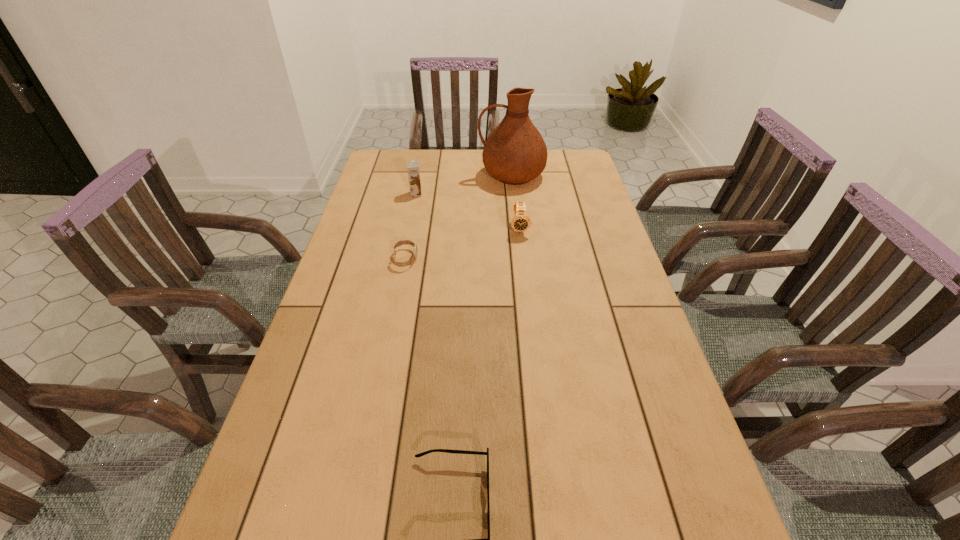
Find the location of a particular element. This screenshot has height=540, width=960. pitcher is located at coordinates (514, 153).

Identify the location of chocolate milk. (413, 167).

The image size is (960, 540). I want to click on the third tallest object, so click(520, 222).

Where is `the right watch`? the right watch is located at coordinates (520, 222).

At what (x,y) coordinates should I click in order to perform the action: click on the left watch. Please return your answer as a coordinate pair (x, y). This screenshot has height=540, width=960. Looking at the image, I should click on (405, 242).

Where is `the second nearest object`? The width and height of the screenshot is (960, 540). the second nearest object is located at coordinates (405, 242).

Identify the location of vacant region located on the side of the pitcher with the handle. (462, 176).

Where is `free spot located 0.070m on the side of the pitcher with the handle`? The image size is (960, 540). free spot located 0.070m on the side of the pitcher with the handle is located at coordinates (460, 176).

The image size is (960, 540). I want to click on vacant space situated 0.280m on the side of the pitcher with the handle, so click(x=404, y=176).

Locate an element on the screen. vacant area situated 0.090m on the left of the chocolate milk is located at coordinates point(385,194).